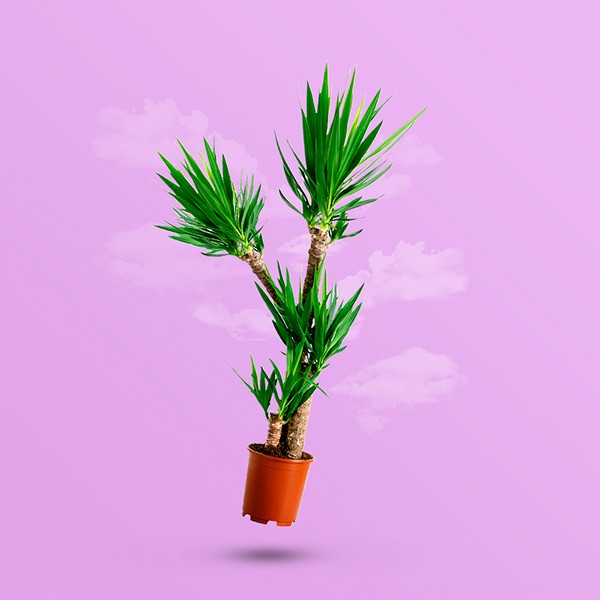
At what (x,y) coordinates should I click in order to perform the action: click on plant. Please return your answer as a coordinate pair (x, y). The height and width of the screenshot is (600, 600). Looking at the image, I should click on (297, 421).